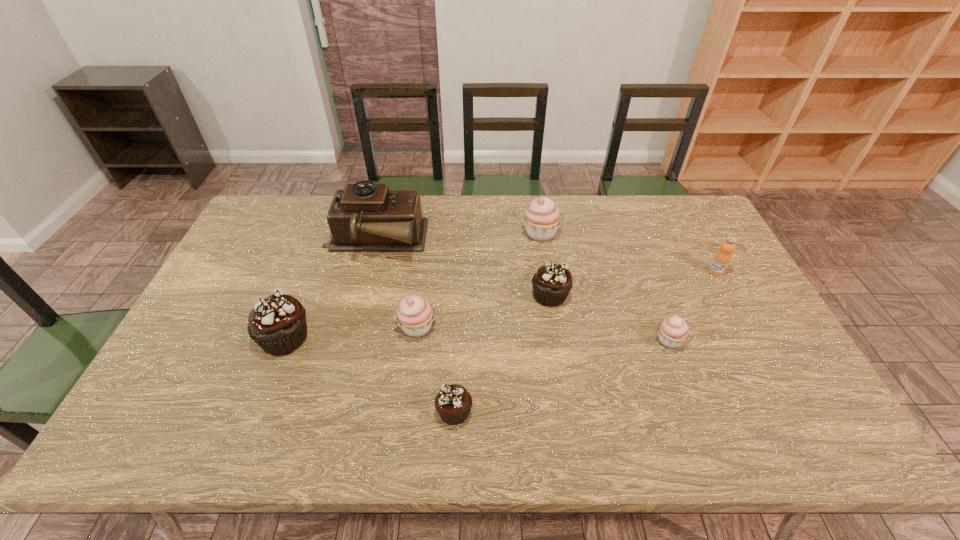
This screenshot has height=540, width=960. What are the coordinates of `vacant space located on the back of the fifth cupcake from right to left` in the screenshot? It's located at (428, 243).

You are a GUI agent. You are given a task and a screenshot of the screen. Output one action in this format:
    pyautogui.click(x=<x>, y=<y>)
    Task: Click on the vacant space located 0.310m on the left of the rightmost pink cupcake
    
    Given the screenshot: What is the action you would take?
    pyautogui.click(x=538, y=340)

Image resolution: width=960 pixels, height=540 pixels. What are the coordinates of `free point located 0.270m on the right of the nearest brown cupcake` in the screenshot? It's located at (588, 411).

Locate an element on the screen. phonograph_record positioned at the far edge is located at coordinates (365, 217).

Identify the location of cupcake situated at the far edge. This screenshot has height=540, width=960. (542, 217).

I want to click on object situated at the near edge, so click(453, 403).

At what (x,y) coordinates should I click in order to perform the action: click on object at the right edge. Please return your answer as a coordinate pair (x, y). Looking at the image, I should click on (722, 258).

The height and width of the screenshot is (540, 960). In the image, there is a desktop. Find the location of `vacant space at the far edge`. vacant space at the far edge is located at coordinates (583, 200).

In order to click on free space at the left edge of the desktop in this screenshot , I will do `click(223, 289)`.

Where is `free space at the right edge of the desktop`? free space at the right edge of the desktop is located at coordinates (714, 247).